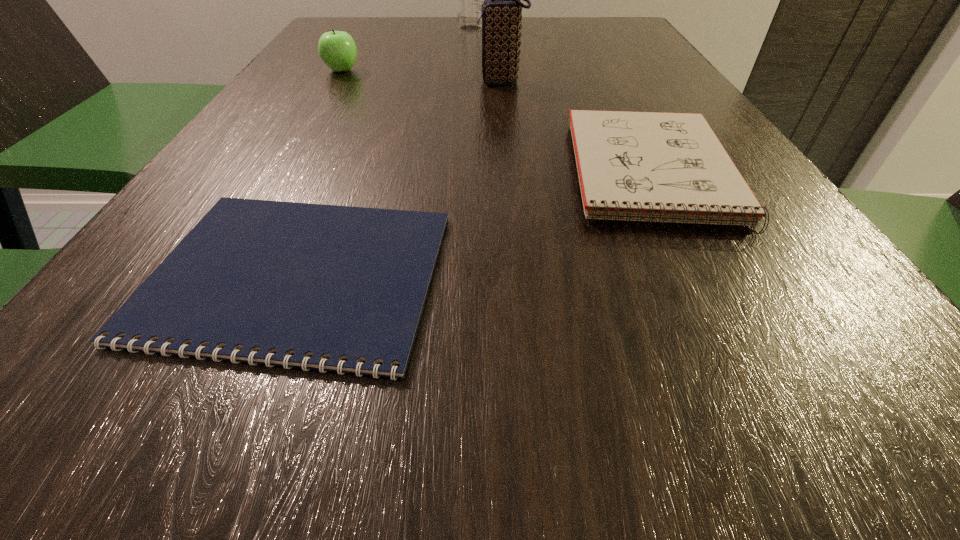
Locate an element on the screen. vodka is located at coordinates (469, 0).

I want to click on the farthest object, so click(469, 0).

I want to click on the fourth shortest object, so click(x=501, y=10).

Where is `the third tallest object`? The image size is (960, 540). the third tallest object is located at coordinates (337, 49).

The width and height of the screenshot is (960, 540). What are the coordinates of `the right notepad` in the screenshot? It's located at (659, 167).

Image resolution: width=960 pixels, height=540 pixels. In order to click on the rightmost object in this screenshot , I will do `click(659, 167)`.

In order to click on the shorter notepad in this screenshot , I will do `click(257, 281)`.

Locate an element on the screen. the left notepad is located at coordinates (257, 281).

Identify the location of blank space located on the front label of the tallest object. This screenshot has width=960, height=540. (553, 29).

This screenshot has width=960, height=540. Find the location of `free space located 0.250m with the zip open on the clutch bag`. free space located 0.250m with the zip open on the clutch bag is located at coordinates pos(356,82).